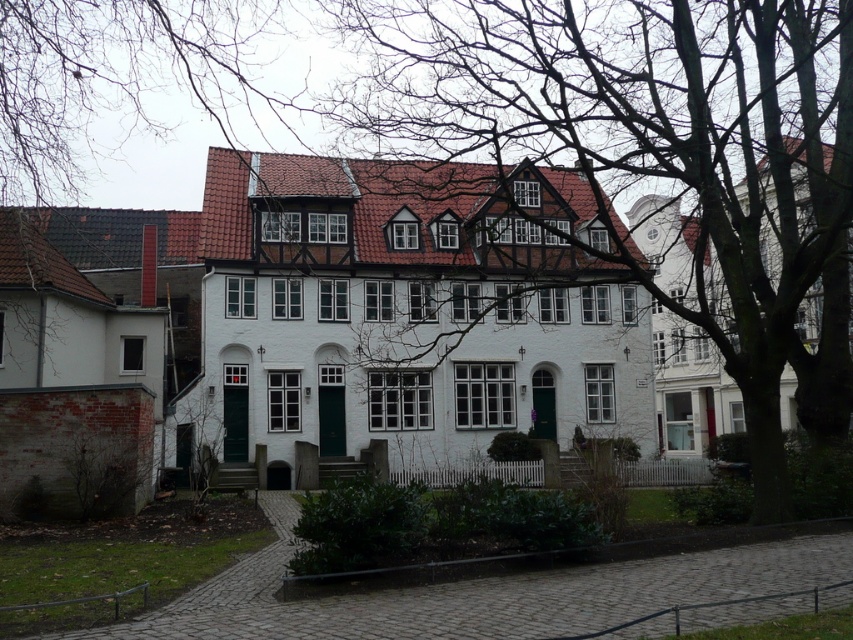
You are standing at the entrance of the house and want to walk towards the smooth bark tree at center. Which direction should you head relative to the house?

The smooth bark tree at center is located at point [653,144], which means it is positioned to the left and slightly forward relative to the house. You should head towards the left side of the house to reach it.